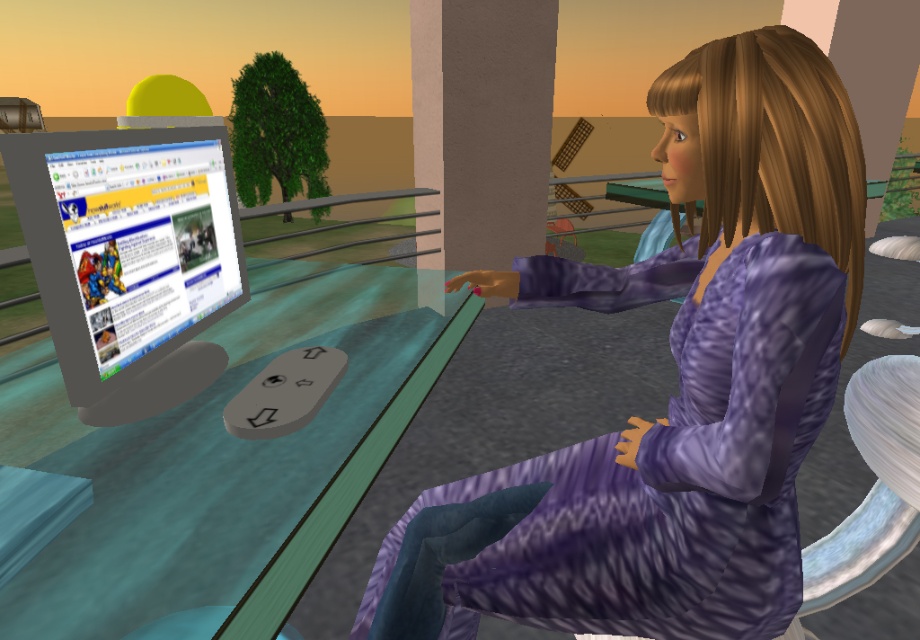
Question: Which object appears closest to the camera in this image?

Choices:
 (A) matte gray monitor at left
 (B) purple satin dress at center

Answer: (B)

Question: In this image, where is purple satin dress at center located relative to matte gray monitor at left?

Choices:
 (A) right
 (B) left

Answer: (A)

Question: Can you confirm if purple satin dress at center is wider than matte gray monitor at left?

Choices:
 (A) no
 (B) yes

Answer: (B)

Question: Among these objects, which one is farthest from the camera?

Choices:
 (A) matte gray monitor at left
 (B) purple satin dress at center

Answer: (A)

Question: Observing the image, what is the correct spatial positioning of purple satin dress at center in reference to matte gray monitor at left?

Choices:
 (A) above
 (B) below

Answer: (B)